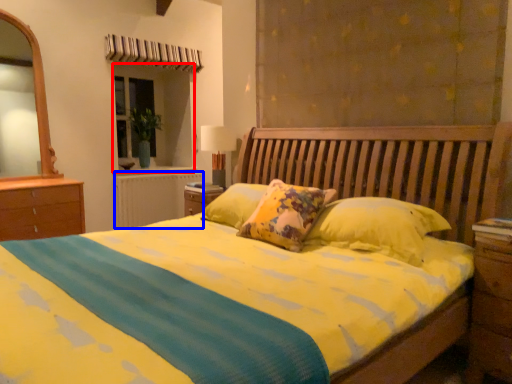
Question: Among these objects, which one is nearest to the camera, window (highlighted by a red box) or radiator (highlighted by a blue box)?

Choices:
 (A) window
 (B) radiator

Answer: (B)